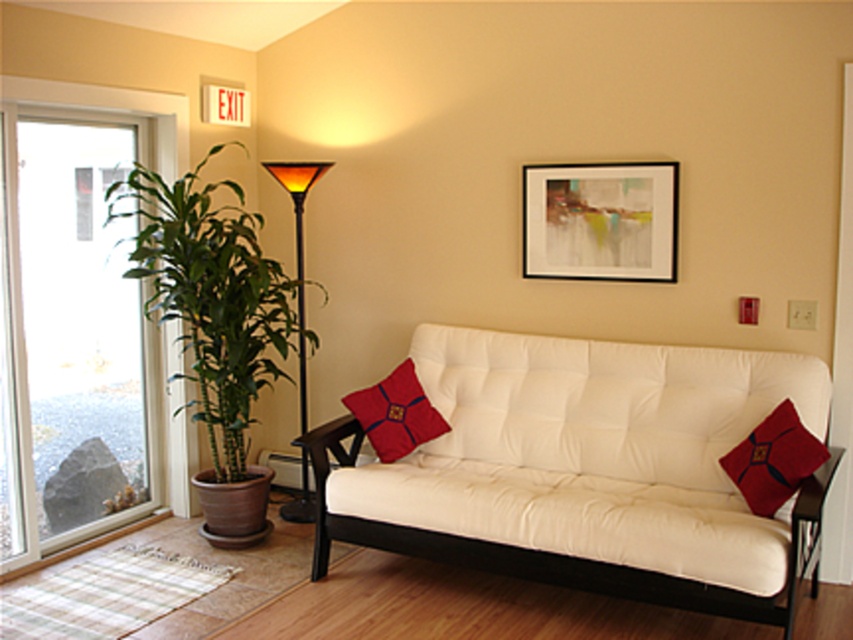
You are sitting on the beige sofa with a black frame and want to reach both the velvet red pillow at center and the amber glass lamp at center. Which object is closer to you?

The velvet red pillow at center is closer to you because it is in front of the amber glass lamp at center.

You are planning to move a small potted plant that is 30 cm wide. You see the clear glass door at left and the velvet red pillow at right. Which object can the potted plant fit through or on?

The clear glass door at left has a larger size compared to velvet red pillow at right. The potted plant can fit through the clear glass door at left since it is larger, but it cannot fit on the velvet red pillow at right due to the pillow being smaller.